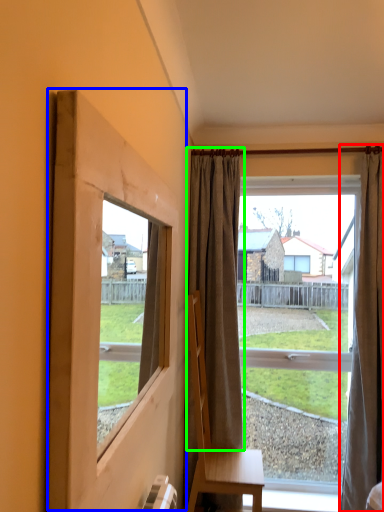
Question: Which object is positioned farthest from curtain (highlighted by a red box)? Select from window frame (highlighted by a blue box) and curtain (highlighted by a green box).

Choices:
 (A) window frame
 (B) curtain

Answer: (A)